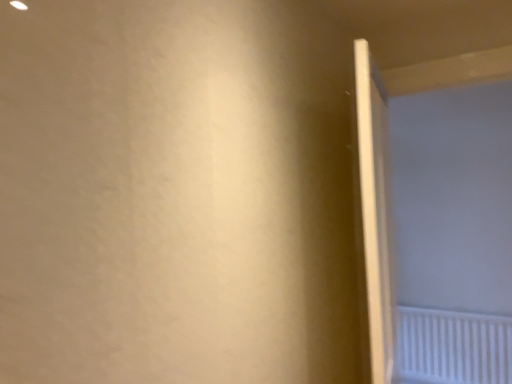
Identify the location of white plastic radiator at lower right. The image size is (512, 384). (453, 347).

At what (x,y) coordinates should I click in order to perform the action: click on white plastic radiator at lower right. Please return your answer as a coordinate pair (x, y). The height and width of the screenshot is (384, 512). Looking at the image, I should click on (453, 347).

From a real-world perspective, does white glossy door at right sit lower than white plastic radiator at lower right?

Actually, white glossy door at right is physically above white plastic radiator at lower right in the real world.

In the scene shown: Is white glossy door at right positioned far away from white plastic radiator at lower right?

white glossy door at right is far away from white plastic radiator at lower right.

The width and height of the screenshot is (512, 384). I want to click on door above the white plastic radiator at lower right (from the image's perspective), so point(375,212).

From the image's perspective, between white glossy door at right and white plastic radiator at lower right, which one is located above?

white glossy door at right.

Does white glossy door at right appear on the right side of white matte screen door at right?

No, white glossy door at right is not to the right of white matte screen door at right.

From a real-world perspective, is white glossy door at right physically located above or below white matte screen door at right?

Clearly, from a real-world perspective, white glossy door at right is below white matte screen door at right.

From the image's perspective, is white glossy door at right located beneath white matte screen door at right?

Yes, from the image's perspective, white glossy door at right is below white matte screen door at right.

From the image's perspective, is white matte screen door at right located beneath white plastic radiator at lower right?

No.

Between white matte screen door at right and white plastic radiator at lower right, which one is positioned behind?

white plastic radiator at lower right.

From a real-world perspective, does white matte screen door at right stand above white plastic radiator at lower right?

Yes.

Which of these two, white matte screen door at right or white plastic radiator at lower right, is bigger?

With larger size is white matte screen door at right.

Where is `screen door lying above the white plastic radiator at lower right (from the image's perspective)`? This screenshot has width=512, height=384. screen door lying above the white plastic radiator at lower right (from the image's perspective) is located at coordinates (436, 230).

Which point is more distant from viewer, (478, 314) or (412, 297)?

Point (412, 297)

Who is taller, white plastic radiator at lower right or white matte screen door at right?

white matte screen door at right.

Between white plastic radiator at lower right and white matte screen door at right, which one has smaller width?

white plastic radiator at lower right is thinner.

Identify the location of door on the left side of white matte screen door at right. (375, 212).

Is white matte screen door at right further to the viewer compared to white glossy door at right?

Yes, the depth of white matte screen door at right is greater than that of white glossy door at right.

Consider the image. From a real-world perspective, which object rests below the other?

In real-world perspective, white glossy door at right is lower.

In terms of width, does white matte screen door at right look wider or thinner when compared to white glossy door at right?

white matte screen door at right is wider than white glossy door at right.

Is white plastic radiator at lower right surrounding white glossy door at right?

That's incorrect, white glossy door at right is not inside white plastic radiator at lower right.

Can you confirm if white plastic radiator at lower right is taller than white glossy door at right?

Incorrect, the height of white plastic radiator at lower right is not larger of that of white glossy door at right.

In the scene shown: Which is more to the left, white plastic radiator at lower right or white glossy door at right?

Positioned to the left is white glossy door at right.

This screenshot has width=512, height=384. What are the coordinates of `radiator behind the white glossy door at right` in the screenshot? It's located at (453, 347).

Locate an element on the screen. The height and width of the screenshot is (384, 512). door below the white matte screen door at right (from the image's perspective) is located at coordinates (375, 212).

Which object lies nearer to the anchor point white plastic radiator at lower right, white glossy door at right or white matte screen door at right?

white matte screen door at right is positioned closer to the anchor white plastic radiator at lower right.

Which object lies nearer to the anchor point white matte screen door at right, white glossy door at right or white plastic radiator at lower right?

white plastic radiator at lower right lies closer to white matte screen door at right than the other object.

Which object lies nearer to the anchor point white glossy door at right, white matte screen door at right or white plastic radiator at lower right?

Based on the image, white matte screen door at right appears to be nearer to white glossy door at right.

Consider the image. Considering their positions, is white plastic radiator at lower right positioned further to white matte screen door at right than white glossy door at right?

white glossy door at right.

Which object lies further to the anchor point white plastic radiator at lower right, white matte screen door at right or white glossy door at right?

white glossy door at right is further to white plastic radiator at lower right.

Which object lies further to the anchor point white glossy door at right, white plastic radiator at lower right or white matte screen door at right?

Based on the image, white plastic radiator at lower right appears to be further to white glossy door at right.

Find the location of a particular element. This screenshot has height=384, width=512. screen door between white glossy door at right and white plastic radiator at lower right along the z-axis is located at coordinates (436, 230).